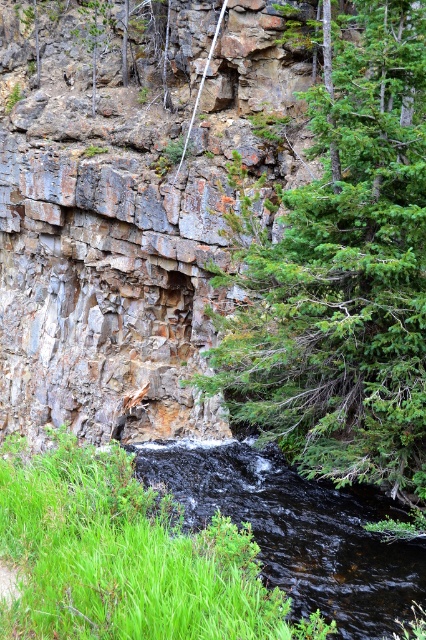
You are standing at the edge of the black glossy stream at lower left and want to reach the green textured tree at center. Which direction should you walk to get there?

You should walk to the right because the green textured tree at center is located to the right of the black glossy stream at lower left.

You are planning to set up a small campsite and need to decide between the area near the green textured tree at center or the black glossy stream at lower left. Considering the size of the available space, which location would provide more room for your campsite?

The green textured tree at center is larger in size than the black glossy stream at lower left, so the area near the green textured tree at center would provide more room for the campsite.

You are a hiker who wants to take a photo of the green textured tree at center and the black glossy stream at lower left. Which object should you focus on first to ensure both are in the same frame?

You should focus on the green textured tree at center first because it is closer to the viewer than the black glossy stream at lower left, allowing both to be captured in the same frame when properly adjusted.